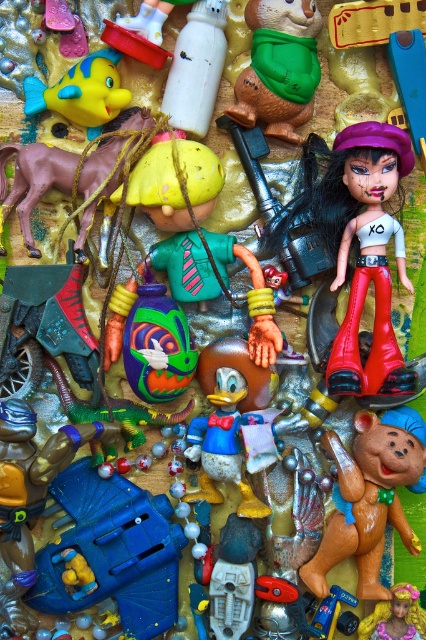
Question: Which object appears farthest from the camera in this image?

Choices:
 (A) matte plastic horse at left
 (B) matte brown teddy bear at center
 (C) rubber yellow fish at upper left
 (D) blonde hair doll at center

Answer: (A)

Question: Which of the following is the closest to the observer?

Choices:
 (A) (363, 378)
 (B) (365, 528)

Answer: (B)

Question: Can you confirm if matte plastic horse at left is positioned to the left of blonde hair doll at center?

Choices:
 (A) no
 (B) yes

Answer: (B)

Question: Where is matte brown teddy bear at center located in relation to matte plastic horse at left in the image?

Choices:
 (A) below
 (B) above

Answer: (A)

Question: Is green rubber bear at center to the left of blonde hair doll at center from the viewer's perspective?

Choices:
 (A) no
 (B) yes

Answer: (B)

Question: Which point is farther to the camera?

Choices:
 (A) (34, 156)
 (B) (388, 604)

Answer: (A)